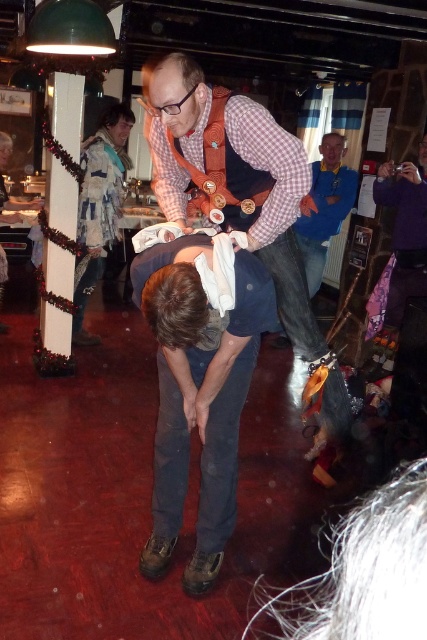
What are the coordinates of the checkered fabric shirt at center?

The checkered fabric shirt at center is located at coordinates point [240,196].